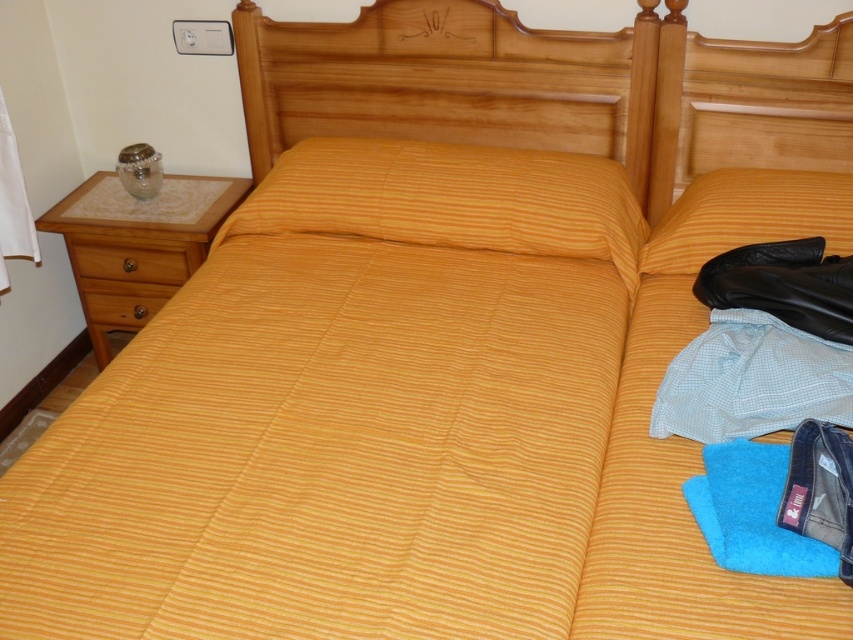
You are standing at the origin point in the room. Can you determine the 2D coordinates of the wooden drawer at lower left?

The 2D coordinates of the wooden drawer at lower left are at point [129,260].

Consider the image. You are organizing a small party and need to place a 12 inch wide cake on the bed. The bed has two objects in the way. Which object, the yellow striped pillow at upper right or the wooden drawer at lower left, should you move to make space?

The yellow striped pillow at upper right should be moved because its width is greater than the wooden drawer at lower left, providing more space for the cake.

You are organizing your bedroom and want to place a new lamp on the wooden drawer at lower left and the wooden drawer at left. Which drawer has more horizontal space to accommodate the lamp?

A: The wooden drawer at lower left has more horizontal space to accommodate the lamp since it is wider than the wooden drawer at left.